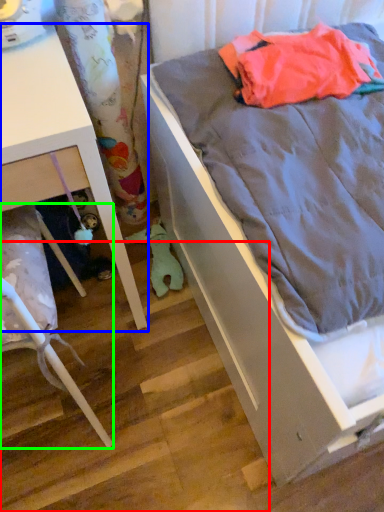
Question: Which object is the farthest from stair (highlighted by a red box)? Choose among these: furniture (highlighted by a blue box) or furniture (highlighted by a green box).

Choices:
 (A) furniture
 (B) furniture

Answer: (A)